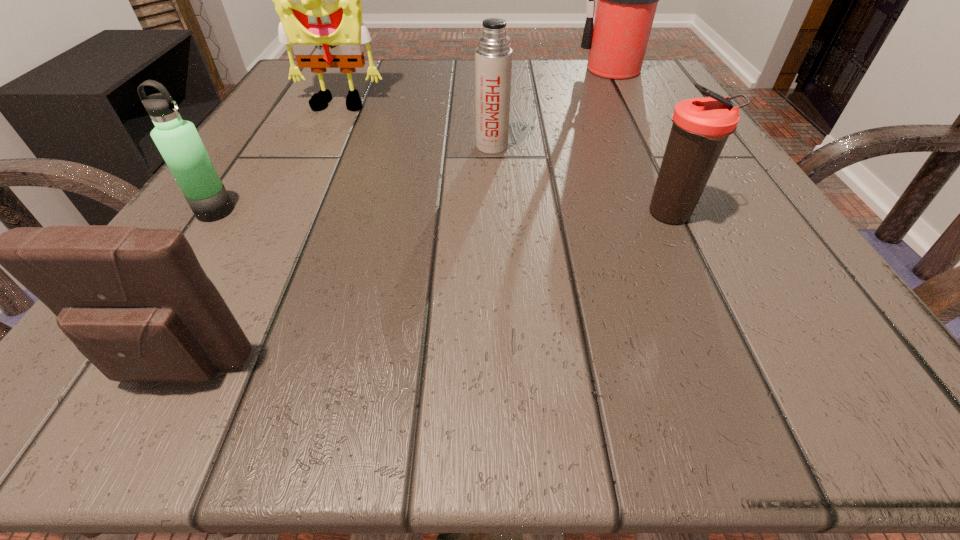
Find the location of a particular element. blank area located on the hose direction of the farthest object is located at coordinates (539, 70).

The width and height of the screenshot is (960, 540). Identify the location of vacant space located 0.200m on the hose direction of the farthest object. (472, 70).

Find the location of a particular element. This screenshot has width=960, height=540. free space located 0.170m on the face of the fifth nearest object is located at coordinates (306, 170).

At what (x,y) coordinates should I click in order to perform the action: click on vacant position located 0.280m on the front of the second thermos bottle from left to right. Please return your answer as a coordinate pair (x, y). The width and height of the screenshot is (960, 540). Looking at the image, I should click on (497, 284).

Locate an element on the screen. The image size is (960, 540). vacant space located on the right of the leftmost thermos bottle is located at coordinates (345, 211).

Where is `free space located on the back of the rightmost thermos bottle`? free space located on the back of the rightmost thermos bottle is located at coordinates (650, 170).

You are a GUI agent. You are given a task and a screenshot of the screen. Output one action in this format:
    pyautogui.click(x=<x>, y=<y>)
    Task: Click on the fire extinguisher located at the far edge
    
    Given the screenshot: What is the action you would take?
    pyautogui.click(x=627, y=0)

I want to click on sponge at the far edge, so 318,0.

Image resolution: width=960 pixels, height=540 pixels. Find the location of `object that is at the near edge`. object that is at the near edge is located at coordinates (135, 302).

Where is `sponge situated at the left edge`? This screenshot has width=960, height=540. sponge situated at the left edge is located at coordinates (318, 0).